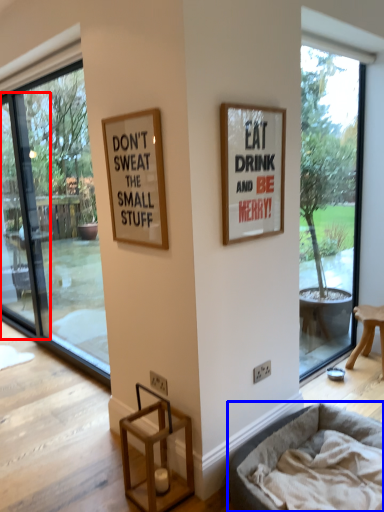
Question: Among these objects, which one is farthest to the camera, screen door (highlighted by a red box) or dog bed (highlighted by a blue box)?

Choices:
 (A) screen door
 (B) dog bed

Answer: (A)